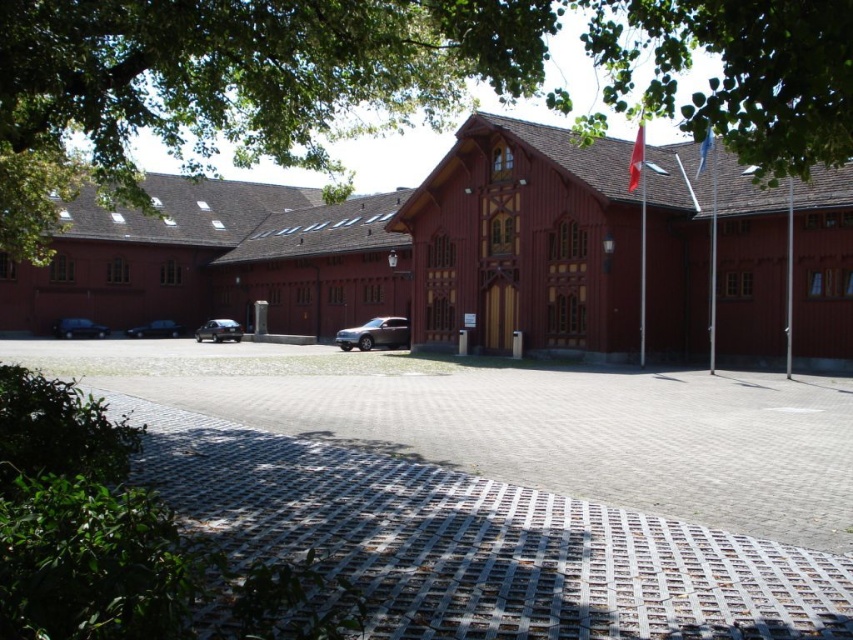
You are a delivery person arriving at the building. You need to park the satin black car at left and then walk to the entrance. Is the gray concrete driveway at center between the car and the entrance?

Yes, the gray concrete driveway at center is between the satin black car at left and the entrance, so you would need to park the car and then walk across the driveway to reach the entrance.